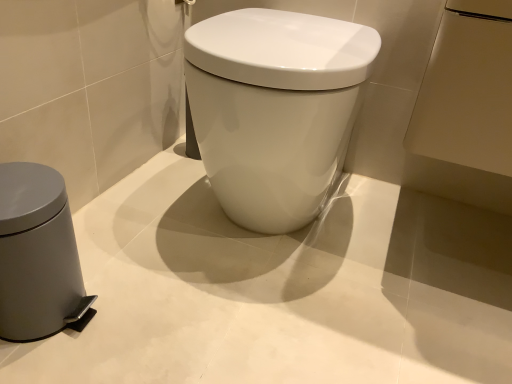
Question: From a real-world perspective, relative to white glossy toilet at center, is gray matte waste container at left vertically above or below?

Choices:
 (A) above
 (B) below

Answer: (B)

Question: Visually, is gray matte waste container at left positioned to the left or to the right of white glossy toilet at center?

Choices:
 (A) left
 (B) right

Answer: (A)

Question: Based on their relative distances, which object is farther from the white glossy toilet at center?

Choices:
 (A) metallic silver towel bar at upper center
 (B) gray matte waste container at left

Answer: (B)

Question: Estimate the real-world distances between objects in this image. Which object is closer to the metallic silver towel bar at upper center?

Choices:
 (A) white glossy toilet at center
 (B) gray matte waste container at left

Answer: (A)